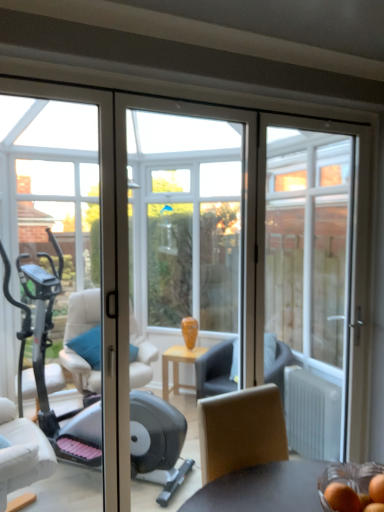
Question: Do you think smooth orange fruit at lower right, which is the first food in right-to-left order, is within orange matte/orange at lower right, which appears as the first food when viewed from the left, or outside of it?

Choices:
 (A) inside
 (B) outside

Answer: (B)

Question: Considering the positions of smooth orange fruit at lower right, which is the first food in right-to-left order, and orange matte/orange at lower right, which appears as the first food when viewed from the left, in the image, is smooth orange fruit at lower right, which is the first food in right-to-left order, wider or thinner than orange matte/orange at lower right, which appears as the first food when viewed from the left,?

Choices:
 (A) wide
 (B) thin

Answer: (B)

Question: Based on their relative distances, which object is nearer to the transparent glass door at right?

Choices:
 (A) orange matte/orange at lower right, the second food when ordered from right to left
 (B) smooth orange fruit at lower right, which is the first food in right-to-left order

Answer: (A)

Question: Which of these objects is positioned closest to the transparent glass door at right?

Choices:
 (A) smooth orange fruit at lower right, the second food when ordered from left to right
 (B) orange matte/orange at lower right, the second food when ordered from right to left

Answer: (B)